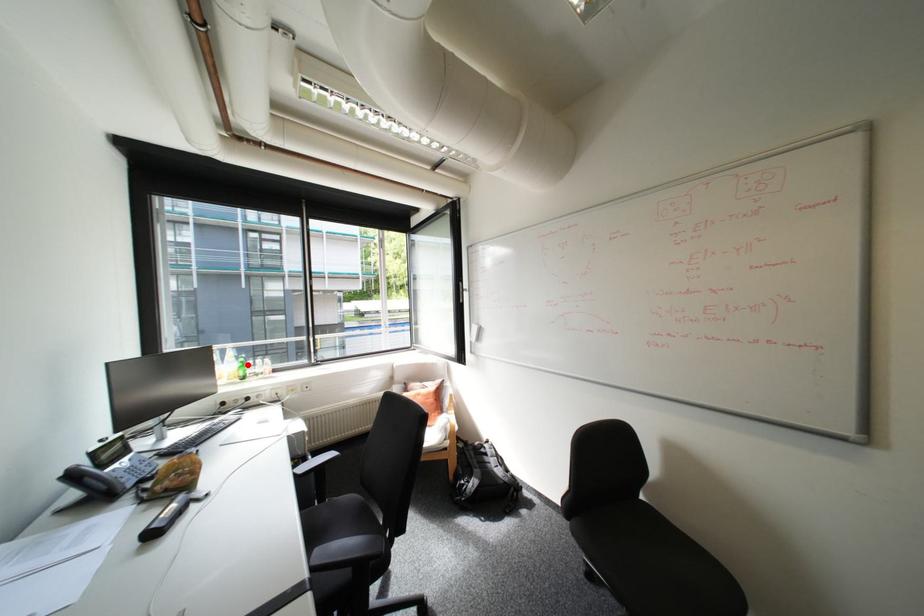
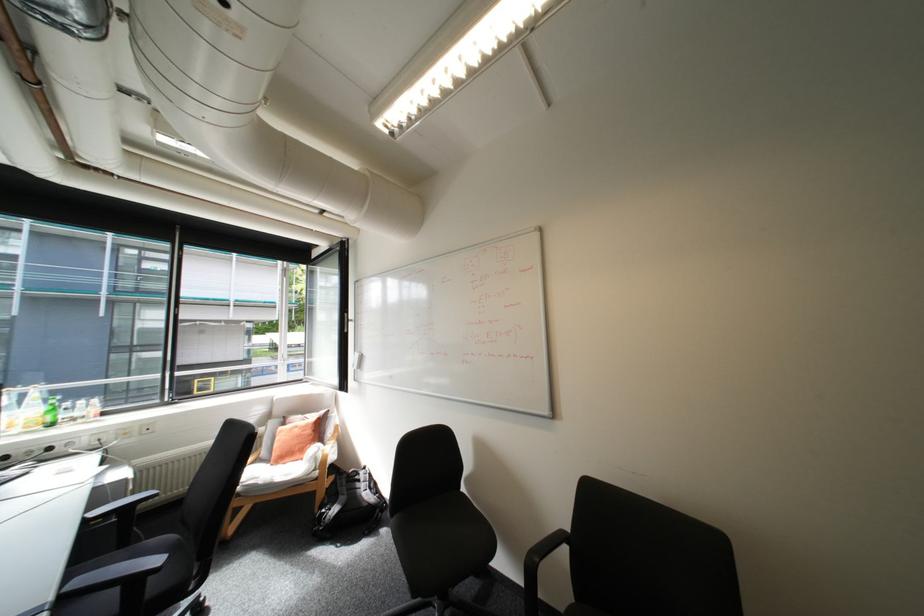
Find the pixel in the second image that matches the highlighted location in the first image.

(55, 408)